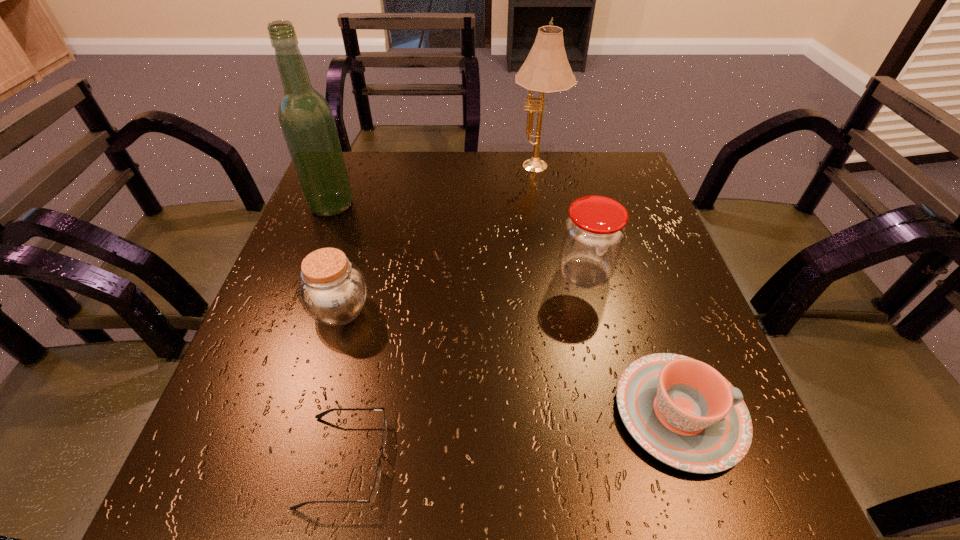
At what (x,y) coordinates should I click in order to perform the action: click on jar present at the right edge. Please return your answer as a coordinate pair (x, y). This screenshot has height=540, width=960. Looking at the image, I should click on (594, 232).

The image size is (960, 540). I want to click on chinaware present at the right edge, so click(x=683, y=412).

This screenshot has height=540, width=960. I want to click on object at the far left corner, so click(306, 119).

The height and width of the screenshot is (540, 960). What are the coordinates of `object situated at the near left corner` in the screenshot? It's located at (375, 488).

The width and height of the screenshot is (960, 540). I want to click on object at the near right corner, so click(x=683, y=412).

In the image, there is a desktop. Identify the location of free region at the far edge. (571, 188).

This screenshot has width=960, height=540. I want to click on vacant space at the near edge of the desktop, so click(327, 475).

The image size is (960, 540). Identify the location of vacant point at the left edge. (313, 231).

In the image, there is a desktop. In order to click on vacant space at the right edge in this screenshot , I will do `click(654, 315)`.

Find the location of a particular element. The width and height of the screenshot is (960, 540). free space at the near left corner is located at coordinates (275, 494).